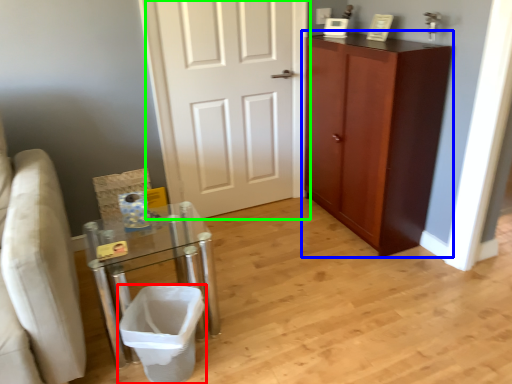
Question: Which object is positioned farthest from laundry basket (highlighted by a red box)? Select from cabinetry (highlighted by a blue box) and door (highlighted by a green box).

Choices:
 (A) cabinetry
 (B) door

Answer: (A)